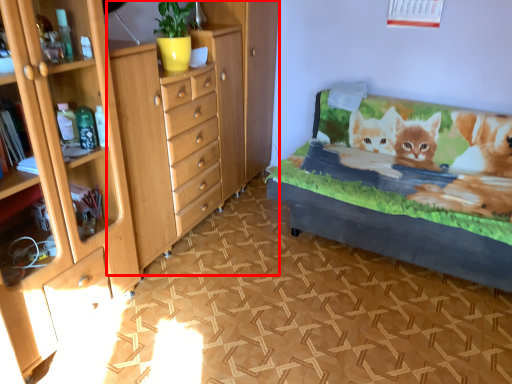
Question: From the image's perspective, what is the correct spatial positioning of chest of drawers (annotated by the red box) in reference to bed frame?

Choices:
 (A) above
 (B) below

Answer: (A)